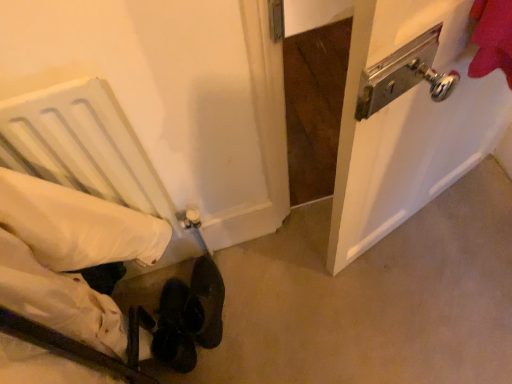
Question: Is white fabric bed at lower left a part of metallic silver door handle at upper right?

Choices:
 (A) yes
 (B) no

Answer: (B)

Question: Considering the relative sizes of metallic silver door handle at upper right and white fabric bed at lower left in the image provided, is metallic silver door handle at upper right wider than white fabric bed at lower left?

Choices:
 (A) yes
 (B) no

Answer: (A)

Question: From a real-world perspective, is metallic silver door handle at upper right positioned over white fabric bed at lower left based on gravity?

Choices:
 (A) yes
 (B) no

Answer: (B)

Question: From the image's perspective, is metallic silver door handle at upper right over white fabric bed at lower left?

Choices:
 (A) no
 (B) yes

Answer: (B)

Question: Is metallic silver door handle at upper right to the right of white fabric bed at lower left from the viewer's perspective?

Choices:
 (A) yes
 (B) no

Answer: (A)

Question: From the image's perspective, is metallic silver door handle at upper right under white fabric bed at lower left?

Choices:
 (A) no
 (B) yes

Answer: (A)

Question: From the image's perspective, does white fabric bed at lower left appear higher than metallic silver door handle at upper right?

Choices:
 (A) yes
 (B) no

Answer: (B)

Question: From a real-world perspective, is white fabric bed at lower left positioned over metallic silver door handle at upper right based on gravity?

Choices:
 (A) yes
 (B) no

Answer: (A)

Question: Is white fabric bed at lower left oriented towards metallic silver door handle at upper right?

Choices:
 (A) no
 (B) yes

Answer: (A)

Question: Can you confirm if white fabric bed at lower left is bigger than metallic silver door handle at upper right?

Choices:
 (A) yes
 (B) no

Answer: (B)

Question: Can you confirm if white fabric bed at lower left is positioned to the left of metallic silver door handle at upper right?

Choices:
 (A) no
 (B) yes

Answer: (B)

Question: Can you confirm if white fabric bed at lower left is taller than metallic silver door handle at upper right?

Choices:
 (A) no
 (B) yes

Answer: (B)

Question: Would you say white fabric bed at lower left is outside leather at lower center?

Choices:
 (A) yes
 (B) no

Answer: (A)